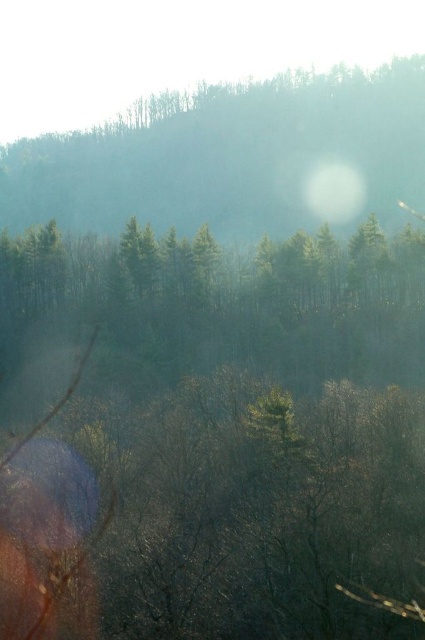
Question: Which object is closer to the camera taking this photo?

Choices:
 (A) green matte trees at center
 (B) white translucent fog at center
 (C) green matte hillside at upper center

Answer: (A)

Question: Does green matte trees at center appear over green matte hillside at upper center?

Choices:
 (A) yes
 (B) no

Answer: (B)

Question: Based on their relative distances, which object is farther from the white translucent fog at center?

Choices:
 (A) green matte trees at center
 (B) green matte hillside at upper center

Answer: (A)

Question: Which point appears closest to the camera in this image?

Choices:
 (A) (351, 211)
 (B) (138, 371)
 (C) (300, 172)

Answer: (B)

Question: Does green matte hillside at upper center have a lesser width compared to white translucent fog at center?

Choices:
 (A) no
 (B) yes

Answer: (A)

Question: Is green matte hillside at upper center smaller than white translucent fog at center?

Choices:
 (A) yes
 (B) no

Answer: (B)